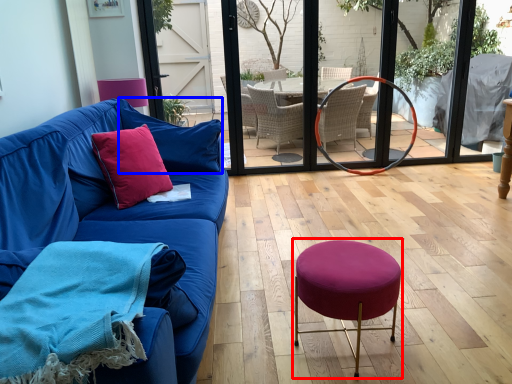
Question: Which point is closer to the camera, bar stool (highlighted by a red box) or pillow (highlighted by a blue box)?

Choices:
 (A) bar stool
 (B) pillow

Answer: (A)